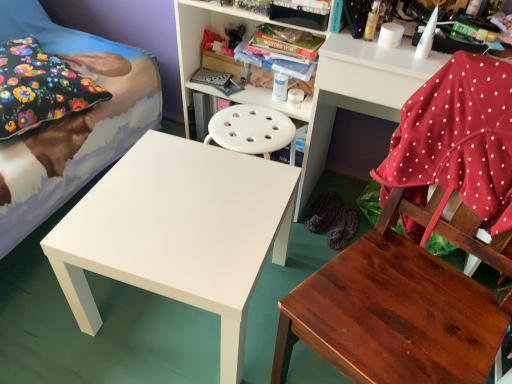
What is the approximate width of white plastic shelf at upper right, which appears as the 2th shelf when viewed from the left?

18.68 inches.

Locate an element on the screen. white plastic shelf at upper center, the first shelf when ordered from left to right is located at coordinates (200, 51).

This screenshot has width=512, height=384. What do you see at coordinates (420, 245) in the screenshot?
I see `wooden chair at lower right` at bounding box center [420, 245].

Find the location of `floral fabric pillow at upper left`. floral fabric pillow at upper left is located at coordinates (39, 88).

From the picture: Would you consider wooden chair at lower right to be distant from white plastic shelf at upper right, which appears as the 2th shelf when viewed from the left?

They are positioned close to each other.

Looking at this image, can white plastic shelf at upper right, arranged as the first shelf when viewed from the right, be found inside wooden chair at lower right?

No, white plastic shelf at upper right, arranged as the first shelf when viewed from the right, is not a part of wooden chair at lower right.

Looking at this image, can you confirm if wooden chair at lower right is positioned to the left of white plastic shelf at upper right, which appears as the 2th shelf when viewed from the left?

Correct, you'll find wooden chair at lower right to the left of white plastic shelf at upper right, which appears as the 2th shelf when viewed from the left.

From the image's perspective, is wooden chair at lower right above white plastic shelf at upper right, arranged as the first shelf when viewed from the right?

No, from the image's perspective, wooden chair at lower right is not above white plastic shelf at upper right, arranged as the first shelf when viewed from the right.

Is white glossy bed at left spatially inside white plastic shelf at upper right, arranged as the first shelf when viewed from the right, or outside of it?

white glossy bed at left is outside white plastic shelf at upper right, arranged as the first shelf when viewed from the right.

Does white glossy bed at left have a smaller size compared to white plastic shelf at upper right, which appears as the 2th shelf when viewed from the left?

No.

Is white glossy bed at left next to white plastic shelf at upper right, which appears as the 2th shelf when viewed from the left, and touching it?

There is a gap between white glossy bed at left and white plastic shelf at upper right, which appears as the 2th shelf when viewed from the left.

Can you confirm if white plastic shelf at upper center, the first shelf when ordered from left to right, is positioned to the left of white glossy bed at left?

No, white plastic shelf at upper center, the first shelf when ordered from left to right, is not to the left of white glossy bed at left.

Which object is closer to the camera, white plastic shelf at upper center, positioned as the 2th shelf in right-to-left order, or white glossy bed at left?

white glossy bed at left.

Does point (222, 6) come farther from viewer compared to point (46, 186)?

Yes, it is behind point (46, 186).

Is white plastic shelf at upper right, which appears as the 2th shelf when viewed from the left, positioned far away from white glossy bed at left?

No, white plastic shelf at upper right, which appears as the 2th shelf when viewed from the left, is in close proximity to white glossy bed at left.

From the picture: Which of these two, white plastic shelf at upper right, which appears as the 2th shelf when viewed from the left, or white glossy bed at left, is thinner?

white plastic shelf at upper right, which appears as the 2th shelf when viewed from the left.

Is point (401, 77) positioned after point (204, 18)?

No, it is in front of (204, 18).

Does white plastic shelf at upper right, which appears as the 2th shelf when viewed from the left, turn towards white plastic shelf at upper center, the first shelf when ordered from left to right?

No, white plastic shelf at upper right, which appears as the 2th shelf when viewed from the left, is not facing towards white plastic shelf at upper center, the first shelf when ordered from left to right.

From a real-world perspective, is white plastic shelf at upper right, which appears as the 2th shelf when viewed from the left, positioned above or below white plastic shelf at upper center, the first shelf when ordered from left to right?

From a real-world perspective, white plastic shelf at upper right, which appears as the 2th shelf when viewed from the left, is physically below white plastic shelf at upper center, the first shelf when ordered from left to right.

Which is in front, white plastic shelf at upper right, which appears as the 2th shelf when viewed from the left, or white plastic shelf at upper center, the first shelf when ordered from left to right?

white plastic shelf at upper right, which appears as the 2th shelf when viewed from the left, is in front.

In the scene shown: From a real-world perspective, is white plastic shelf at upper right, arranged as the first shelf when viewed from the right, located beneath floral fabric pillow at upper left?

Yes, from a real-world perspective, white plastic shelf at upper right, arranged as the first shelf when viewed from the right, is beneath floral fabric pillow at upper left.

Is white plastic shelf at upper right, which appears as the 2th shelf when viewed from the left, positioned before floral fabric pillow at upper left?

Yes, white plastic shelf at upper right, which appears as the 2th shelf when viewed from the left, is closer to the camera.

Do you think white plastic shelf at upper right, which appears as the 2th shelf when viewed from the left, is within floral fabric pillow at upper left, or outside of it?

The correct answer is: outside.

Does white plastic shelf at upper right, which appears as the 2th shelf when viewed from the left, appear on the right side of floral fabric pillow at upper left?

Yes.

In the scene shown: Is wooden chair at lower right positioned with its back to white glossy bed at left?

No, wooden chair at lower right's orientation is not away from white glossy bed at left.

Between wooden chair at lower right and white glossy bed at left, which one has smaller width?

Thinner between the two is wooden chair at lower right.

From a real-world perspective, is wooden chair at lower right on white glossy bed at left?

No, from a real-world perspective, wooden chair at lower right is not above white glossy bed at left.

Consider the image. From the image's perspective, is wooden chair at lower right located above or below white glossy bed at left?

Clearly, from the image's perspective, wooden chair at lower right is below white glossy bed at left.

Locate an element on the screen. chair in front of the white plastic shelf at upper right, which appears as the 2th shelf when viewed from the left is located at coordinates (420, 245).

Where is `bed above the white plastic shelf at upper right, which appears as the 2th shelf when viewed from the left (from the image's perspective)`? bed above the white plastic shelf at upper right, which appears as the 2th shelf when viewed from the left (from the image's perspective) is located at coordinates (72, 122).

Looking at the image, which one is located closer to white plastic shelf at upper right, arranged as the first shelf when viewed from the right, floral fabric pillow at upper left or white plastic shelf at upper center, the first shelf when ordered from left to right?

white plastic shelf at upper center, the first shelf when ordered from left to right.

Considering their positions, is white matte table at center positioned closer to white plastic shelf at upper center, the first shelf when ordered from left to right, than white plastic shelf at upper right, arranged as the first shelf when viewed from the right?

Among the two, white plastic shelf at upper right, arranged as the first shelf when viewed from the right, is located nearer to white plastic shelf at upper center, the first shelf when ordered from left to right.

When comparing their distances from floral fabric pillow at upper left, does white matte table at center or white plastic shelf at upper right, arranged as the first shelf when viewed from the right, seem closer?

The object closer to floral fabric pillow at upper left is white matte table at center.

Based on their spatial positions, is white glossy bed at left or white plastic shelf at upper right, which appears as the 2th shelf when viewed from the left, closer to wooden chair at lower right?

white plastic shelf at upper right, which appears as the 2th shelf when viewed from the left, is closer to wooden chair at lower right.

Which object lies nearer to the anchor point wooden chair at lower right, white plastic shelf at upper center, the first shelf when ordered from left to right, or white plastic shelf at upper right, arranged as the first shelf when viewed from the right?

white plastic shelf at upper right, arranged as the first shelf when viewed from the right, lies closer to wooden chair at lower right than the other object.

Estimate the real-world distances between objects in this image. Which object is further from white plastic shelf at upper right, arranged as the first shelf when viewed from the right, white matte table at center or floral fabric pillow at upper left?

floral fabric pillow at upper left lies further to white plastic shelf at upper right, arranged as the first shelf when viewed from the right, than the other object.

Considering their positions, is white plastic shelf at upper center, positioned as the 2th shelf in right-to-left order, positioned further to white plastic shelf at upper right, which appears as the 2th shelf when viewed from the left, than wooden chair at lower right?

Based on the image, wooden chair at lower right appears to be further to white plastic shelf at upper right, which appears as the 2th shelf when viewed from the left.

Estimate the real-world distances between objects in this image. Which object is closer to white plastic shelf at upper center, the first shelf when ordered from left to right, white matte table at center or floral fabric pillow at upper left?

Among the two, floral fabric pillow at upper left is located nearer to white plastic shelf at upper center, the first shelf when ordered from left to right.

Where is `table between white glossy bed at left and white plastic shelf at upper center, the first shelf when ordered from left to right, from left to right`? table between white glossy bed at left and white plastic shelf at upper center, the first shelf when ordered from left to right, from left to right is located at coordinates (179, 232).

Identify the location of shelf between floral fabric pillow at upper left and wooden chair at lower right in the horizontal direction. (200, 51).

Where is `chair located between white matte table at center and white plastic shelf at upper right, arranged as the first shelf when viewed from the right, in the left-right direction`? This screenshot has height=384, width=512. chair located between white matte table at center and white plastic shelf at upper right, arranged as the first shelf when viewed from the right, in the left-right direction is located at coordinates (420, 245).

Where is `pillow between white glossy bed at left and white plastic shelf at upper right, which appears as the 2th shelf when viewed from the left, from left to right`? The width and height of the screenshot is (512, 384). pillow between white glossy bed at left and white plastic shelf at upper right, which appears as the 2th shelf when viewed from the left, from left to right is located at coordinates (39, 88).